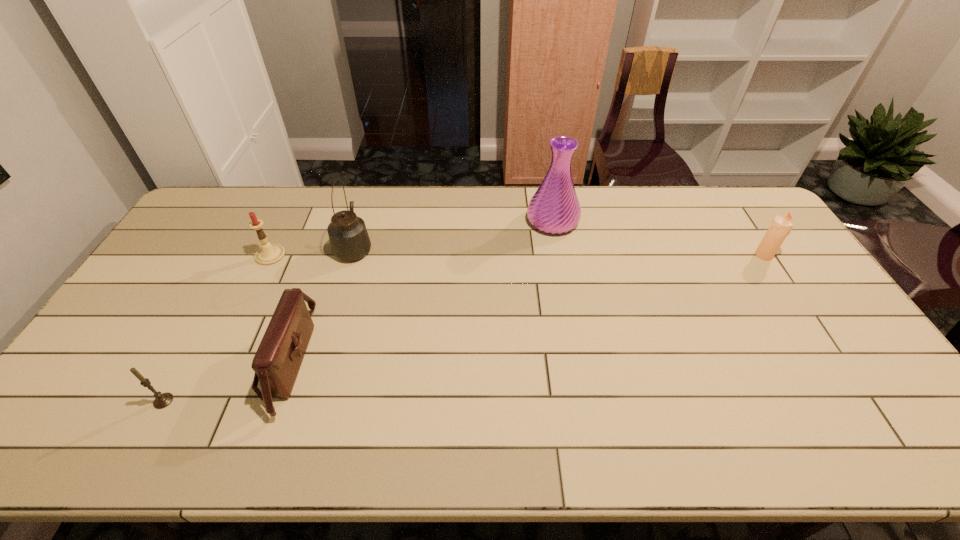
Identify which object is the second nearest to the shortest candle. Please provide its 2D coordinates. Your answer should be formatted as a tuple, i.e. [(x, y)], where the tuple contains the x and y coordinates of a point satisfying the conditions above.

[(268, 254)]

You are a GUI agent. You are given a task and a screenshot of the screen. Output one action in this format:
    pyautogui.click(x=<x>, y=<y>)
    Task: Click on the object that is the fifth nearest to the shoulder bag
    
    Given the screenshot: What is the action you would take?
    pyautogui.click(x=780, y=227)

Identify which candle is the nearest to the nearest candle. Please provide its 2D coordinates. Your answer should be formatted as a tuple, i.e. [(x, y)], where the tuple contains the x and y coordinates of a point satisfying the conditions above.

[(268, 254)]

The height and width of the screenshot is (540, 960). Identify the location of candle that stands as the closest to the kettle. (268, 254).

Identify the location of vacant space that satisfies the following two spatial constraints: 1. on the back side of the rightmost candle; 2. on the left side of the second candle from left to right. (271, 255).

Identify the location of free space that satisfies the following two spatial constraints: 1. on the back side of the vase; 2. on the left side of the fifth object from right to left. (287, 221).